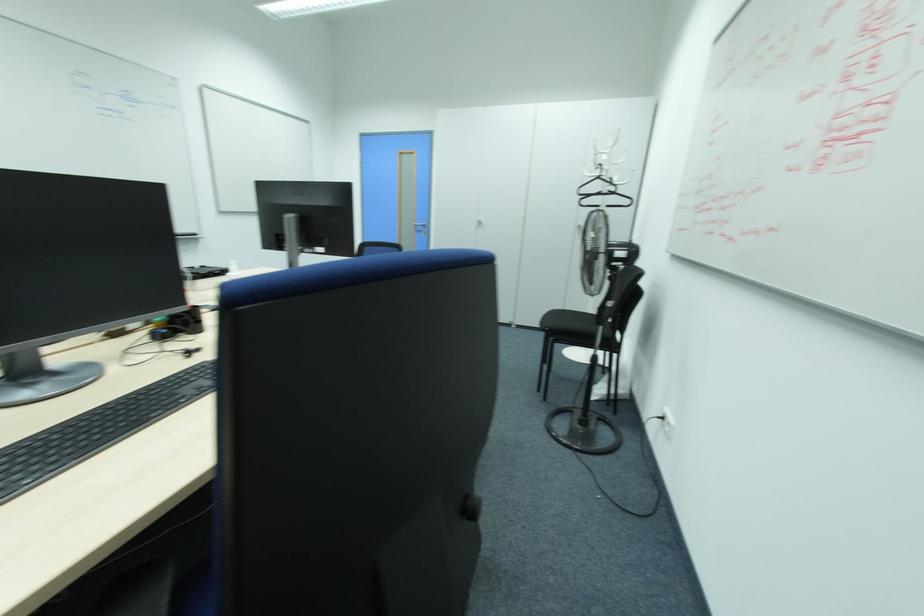
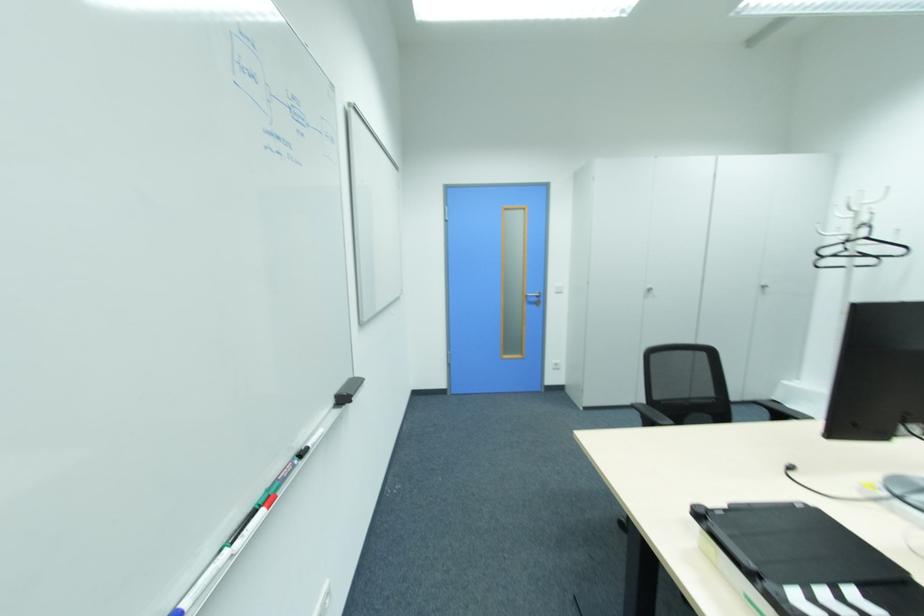
Find the pixel in the second image that matches [599,177] in the first image.

(865, 238)